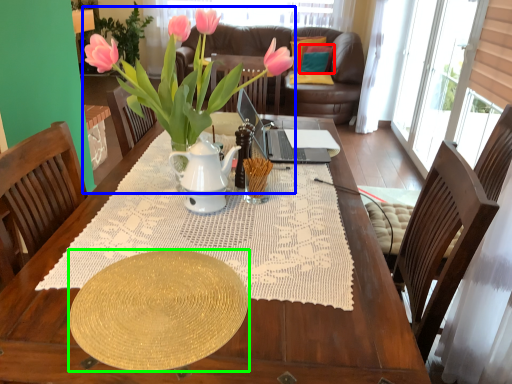
Question: Based on their relative distances, which object is farther from pillow (highlighted by a red box)? Choose from houseplant (highlighted by a blue box) and plate (highlighted by a green box).

Choices:
 (A) houseplant
 (B) plate

Answer: (B)